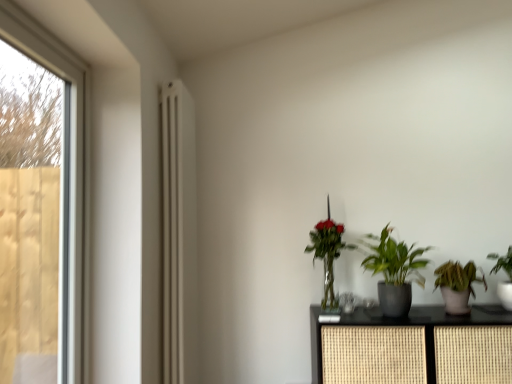
This screenshot has width=512, height=384. I want to click on matte white radiator at left, so click(x=179, y=234).

Is the depth of rattan cabinet at center greater than that of transparent glass screen door at left?

Yes, the depth of rattan cabinet at center is greater than that of transparent glass screen door at left.

Is rattan cabinet at center touching transparent glass screen door at left?

rattan cabinet at center is not next to transparent glass screen door at left, and they're not touching.

Is point (377, 343) positioned in front of point (1, 194)?

That is True.

Considering the relative sizes of rattan cabinet at center and transparent glass screen door at left in the image provided, is rattan cabinet at center smaller than transparent glass screen door at left?

No.

Is transparent glass screen door at left oriented towards green leafy plant at right, which is counted as the 4th houseplant, starting from the left?

No, transparent glass screen door at left is not facing towards green leafy plant at right, which is counted as the 4th houseplant, starting from the left.

Can you confirm if transparent glass screen door at left is smaller than green leafy plant at right, the first houseplant when ordered from right to left?

No.

From a real-world perspective, is transparent glass screen door at left positioned under green leafy plant at right, the first houseplant when ordered from right to left, based on gravity?

No, from a real-world perspective, transparent glass screen door at left is not below green leafy plant at right, the first houseplant when ordered from right to left.

How many degrees apart are the facing directions of transparent glass screen door at left and green leafy plant at right, the first houseplant when ordered from right to left?

The angle between the facing direction of transparent glass screen door at left and the facing direction of green leafy plant at right, the first houseplant when ordered from right to left, is 92 degrees.

Measure the distance from transparent glass screen door at left to green glossy plant at center, the first houseplant in the left-to-right sequence.

The distance of transparent glass screen door at left from green glossy plant at center, the first houseplant in the left-to-right sequence, is 4.29 feet.

Is transparent glass screen door at left aimed at green glossy plant at center, which appears as the 4th houseplant when viewed from the right?

No, transparent glass screen door at left does not turn towards green glossy plant at center, which appears as the 4th houseplant when viewed from the right.

Which houseplant is the 4th one when counting from the back of the transparent glass screen door at left? Please provide its 2D coordinates.

[(328, 254)]

Based on the photo, which is more distant, (41, 294) or (325, 289)?

The point (325, 289) is behind.

Considering the sizes of objects matte white radiator at left and green glossy plant at center, the first houseplant in the left-to-right sequence, in the image provided, who is taller, matte white radiator at left or green glossy plant at center, the first houseplant in the left-to-right sequence,?

With more height is matte white radiator at left.

In terms of width, does matte white radiator at left look wider or thinner when compared to green glossy plant at center, which appears as the 4th houseplant when viewed from the right?

matte white radiator at left is thinner than green glossy plant at center, which appears as the 4th houseplant when viewed from the right.

From a real-world perspective, which is physically below, matte white radiator at left or green glossy plant at center, the first houseplant in the left-to-right sequence?

From a 3D spatial view, green glossy plant at center, the first houseplant in the left-to-right sequence, is below.

Is point (193, 323) in front of point (335, 246)?

No, it is not.

Does point (426, 366) come closer to viewer compared to point (507, 256)?

Yes.

Between rattan cabinet at center and green leafy plant at right, which is counted as the 4th houseplant, starting from the left, which one has more height?

rattan cabinet at center is taller.

Which of these two, rattan cabinet at center or green leafy plant at right, which is counted as the 4th houseplant, starting from the left, is wider?

Wider between the two is rattan cabinet at center.

From a real-world perspective, which is physically above, rattan cabinet at center or green leafy plant at right, the first houseplant when ordered from right to left?

green leafy plant at right, the first houseplant when ordered from right to left, from a real-world perspective.

Is point (191, 106) positioned behind point (399, 314)?

Yes, point (191, 106) is farther from viewer.

From the image's perspective, is matte white radiator at left positioned above or below green matte plant at center, which is counted as the third houseplant, starting from the right?

From the image's perspective, matte white radiator at left appears above green matte plant at center, which is counted as the third houseplant, starting from the right.

Would you say matte white radiator at left is to the left or to the right of green matte plant at center, which is counted as the third houseplant, starting from the right, in the picture?

matte white radiator at left is positioned on green matte plant at center, which is counted as the third houseplant, starting from the right,'s left side.

Is matte white radiator at left positioned far away from green matte plant at center, which is counted as the third houseplant, starting from the right?

Yes.

Who is bigger, matte white radiator at left or green leafy plant at right, which is counted as the 4th houseplant, starting from the left?

With larger size is matte white radiator at left.

Would you say matte white radiator at left is to the left or to the right of green leafy plant at right, which is counted as the 4th houseplant, starting from the left, in the picture?

Based on their positions, matte white radiator at left is located to the left of green leafy plant at right, which is counted as the 4th houseplant, starting from the left.

Who is more distant, matte white radiator at left or green leafy plant at right, which is counted as the 4th houseplant, starting from the left?

green leafy plant at right, which is counted as the 4th houseplant, starting from the left, is behind.

The height and width of the screenshot is (384, 512). In order to click on houseplant that is the 4th object to the right of the matte white radiator at left, starting at the anchor in this screenshot , I will do click(x=507, y=275).

The width and height of the screenshot is (512, 384). In order to click on screen door that appears in front of the rattan cabinet at center in this screenshot , I will do `click(33, 220)`.

This screenshot has height=384, width=512. Find the location of `the 4th houseplant counting from the right of the transparent glass screen door at left`. the 4th houseplant counting from the right of the transparent glass screen door at left is located at coordinates 507,275.

Which object lies nearer to the anchor point green matte plant at center, placed as the 2th houseplant when sorted from left to right, transparent glass screen door at left or matte white radiator at left?

matte white radiator at left lies closer to green matte plant at center, placed as the 2th houseplant when sorted from left to right, than the other object.

Looking at this image, looking at the image, which one is located closer to transparent glass screen door at left, matte white radiator at left or green matte houseplant at lower right, which ranks as the 3th houseplant in left-to-right order?

Based on the image, matte white radiator at left appears to be nearer to transparent glass screen door at left.

When comparing their distances from green matte plant at center, placed as the 2th houseplant when sorted from left to right, does green leafy plant at right, which is counted as the 4th houseplant, starting from the left, or green glossy plant at center, the first houseplant in the left-to-right sequence, seem closer?

Among the two, green glossy plant at center, the first houseplant in the left-to-right sequence, is located nearer to green matte plant at center, placed as the 2th houseplant when sorted from left to right.

Based on their spatial positions, is green matte plant at center, placed as the 2th houseplant when sorted from left to right, or matte white radiator at left further from green matte houseplant at lower right, which ranks as the 3th houseplant in left-to-right order?

matte white radiator at left is further to green matte houseplant at lower right, which ranks as the 3th houseplant in left-to-right order.

Considering their positions, is rattan cabinet at center positioned further to matte white radiator at left than green matte houseplant at lower right, positioned as the second houseplant in right-to-left order?

green matte houseplant at lower right, positioned as the second houseplant in right-to-left order, lies further to matte white radiator at left than the other object.

Looking at the image, which one is located further to rattan cabinet at center, matte white radiator at left or green glossy plant at center, which appears as the 4th houseplant when viewed from the right?

Among the two, matte white radiator at left is located further to rattan cabinet at center.

Considering their positions, is rattan cabinet at center positioned further to green matte plant at center, placed as the 2th houseplant when sorted from left to right, than green matte houseplant at lower right, which ranks as the 3th houseplant in left-to-right order?

The object further to green matte plant at center, placed as the 2th houseplant when sorted from left to right, is rattan cabinet at center.

Considering their positions, is green glossy plant at center, the first houseplant in the left-to-right sequence, positioned closer to transparent glass screen door at left than green matte houseplant at lower right, positioned as the second houseplant in right-to-left order?

green glossy plant at center, the first houseplant in the left-to-right sequence, is closer to transparent glass screen door at left.

The image size is (512, 384). Identify the location of furniture located between matte white radiator at left and green leafy plant at right, the first houseplant when ordered from right to left, in the left-right direction. (408, 348).

The width and height of the screenshot is (512, 384). I want to click on houseplant between green matte plant at center, placed as the 2th houseplant when sorted from left to right, and green leafy plant at right, the first houseplant when ordered from right to left, so click(x=457, y=285).

Locate an element on the screen. Image resolution: width=512 pixels, height=384 pixels. houseplant located between matte white radiator at left and green matte plant at center, which is counted as the third houseplant, starting from the right, in the left-right direction is located at coordinates (328, 254).

This screenshot has width=512, height=384. I want to click on radiator between transparent glass screen door at left and green leafy plant at right, the first houseplant when ordered from right to left, from left to right, so tap(179, 234).